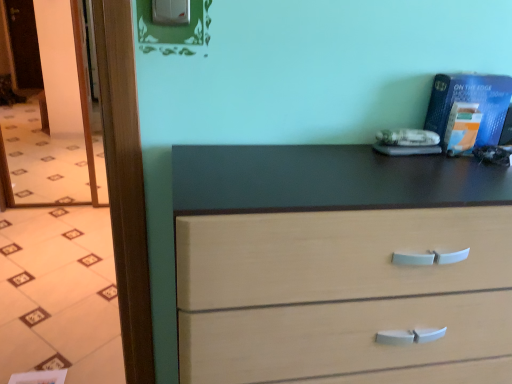
Question: Can transparent glass door at left be found inside light wood chest of drawers at center?

Choices:
 (A) yes
 (B) no

Answer: (B)

Question: Is light wood chest of drawers at center not inside transparent glass door at left?

Choices:
 (A) yes
 (B) no

Answer: (A)

Question: From a real-world perspective, is light wood chest of drawers at center beneath transparent glass door at left?

Choices:
 (A) no
 (B) yes

Answer: (B)

Question: Can you confirm if light wood chest of drawers at center is taller than transparent glass door at left?

Choices:
 (A) no
 (B) yes

Answer: (A)

Question: From the image's perspective, is light wood chest of drawers at center under transparent glass door at left?

Choices:
 (A) yes
 (B) no

Answer: (A)

Question: Does light wood chest of drawers at center have a lesser width compared to transparent glass door at left?

Choices:
 (A) no
 (B) yes

Answer: (A)

Question: Is the position of transparent glass door at left more distant than that of light wood chest of drawers at center?

Choices:
 (A) yes
 (B) no

Answer: (A)

Question: From a real-world perspective, does transparent glass door at left stand above light wood chest of drawers at center?

Choices:
 (A) yes
 (B) no

Answer: (A)

Question: Is transparent glass door at left to the left of light wood chest of drawers at center from the viewer's perspective?

Choices:
 (A) no
 (B) yes

Answer: (B)

Question: Is transparent glass door at left thinner than light wood chest of drawers at center?

Choices:
 (A) no
 (B) yes

Answer: (B)

Question: From the image's perspective, is transparent glass door at left under light wood chest of drawers at center?

Choices:
 (A) no
 (B) yes

Answer: (A)

Question: Can you confirm if transparent glass door at left is bigger than light wood chest of drawers at center?

Choices:
 (A) yes
 (B) no

Answer: (B)

Question: From the image's perspective, is light wood chest of drawers at center positioned above or below transparent glass door at left?

Choices:
 (A) above
 (B) below

Answer: (B)